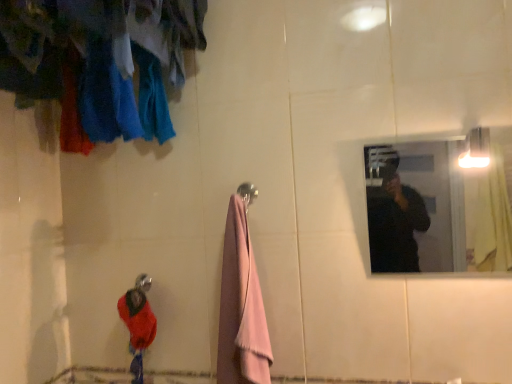
Question: Is velvet red sweater at lower left thinner than pink fluffy towel at center?

Choices:
 (A) no
 (B) yes

Answer: (B)

Question: Can we say velvet red sweater at lower left lies outside pink fluffy towel at center?

Choices:
 (A) no
 (B) yes

Answer: (B)

Question: Is there a large distance between velvet red sweater at lower left and pink fluffy towel at center?

Choices:
 (A) yes
 (B) no

Answer: (B)

Question: Does velvet red sweater at lower left come in front of pink fluffy towel at center?

Choices:
 (A) yes
 (B) no

Answer: (B)

Question: Is velvet red sweater at lower left shorter than pink fluffy towel at center?

Choices:
 (A) yes
 (B) no

Answer: (A)

Question: Is velvet red sweater at lower left at the left side of pink fluffy towel at center?

Choices:
 (A) yes
 (B) no

Answer: (A)

Question: Is metallic reflective mirror at upper right at the back of pink fluffy towel at center?

Choices:
 (A) no
 (B) yes

Answer: (A)

Question: Is pink fluffy towel at center thinner than metallic reflective mirror at upper right?

Choices:
 (A) yes
 (B) no

Answer: (B)

Question: Does pink fluffy towel at center touch metallic reflective mirror at upper right?

Choices:
 (A) yes
 (B) no

Answer: (B)

Question: Considering the relative sizes of pink fluffy towel at center and metallic reflective mirror at upper right in the image provided, is pink fluffy towel at center taller than metallic reflective mirror at upper right?

Choices:
 (A) yes
 (B) no

Answer: (A)

Question: From the image's perspective, is pink fluffy towel at center over metallic reflective mirror at upper right?

Choices:
 (A) yes
 (B) no

Answer: (B)

Question: From the image's perspective, is pink fluffy towel at center located beneath metallic reflective mirror at upper right?

Choices:
 (A) yes
 (B) no

Answer: (A)

Question: Can you confirm if velvet red sweater at lower left is bigger than metallic reflective mirror at upper right?

Choices:
 (A) yes
 (B) no

Answer: (B)